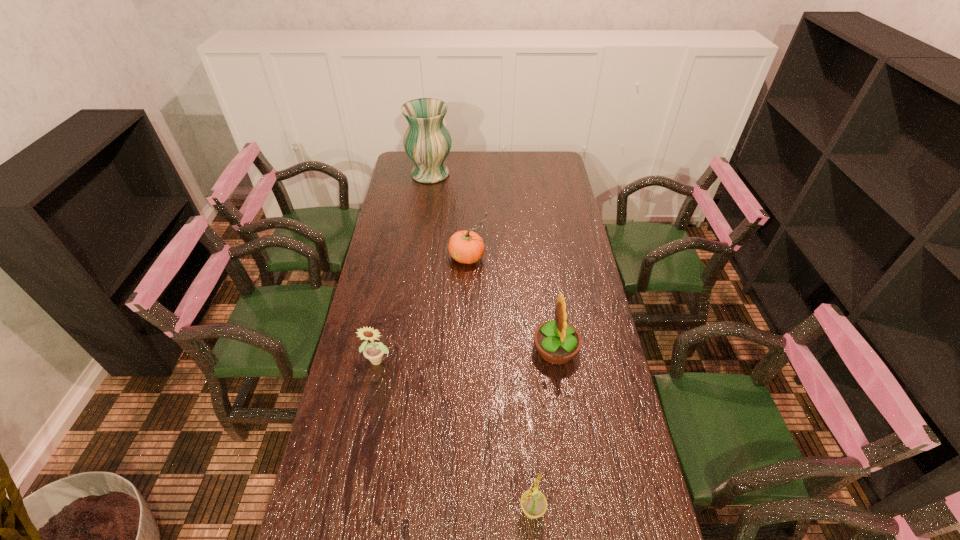
Identify the location of blank area in the image that satisfies the following two spatial constraints: 1. on the face of the rightmost object; 2. on the front-facing side of the leftmost sunflower. The width and height of the screenshot is (960, 540). (557, 360).